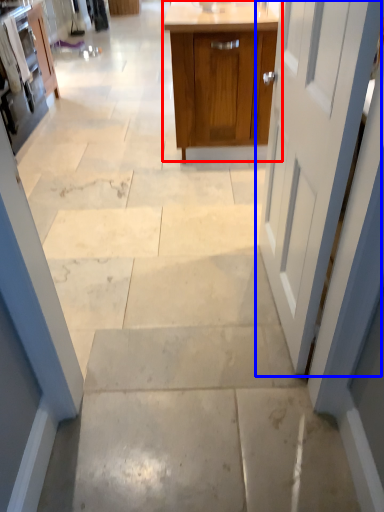
Question: Which point is further to the camera, cabinetry (highlighted by a red box) or door (highlighted by a blue box)?

Choices:
 (A) cabinetry
 (B) door

Answer: (A)